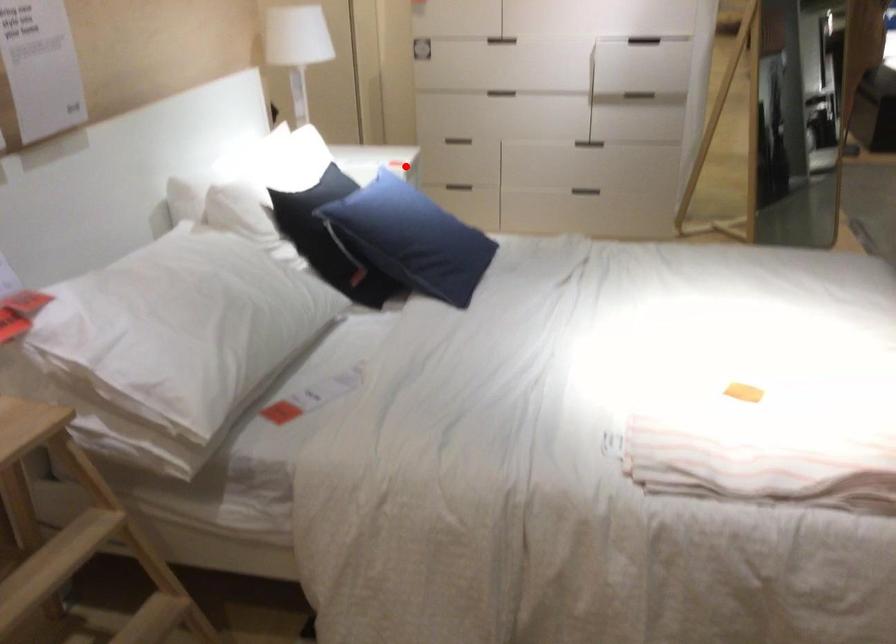
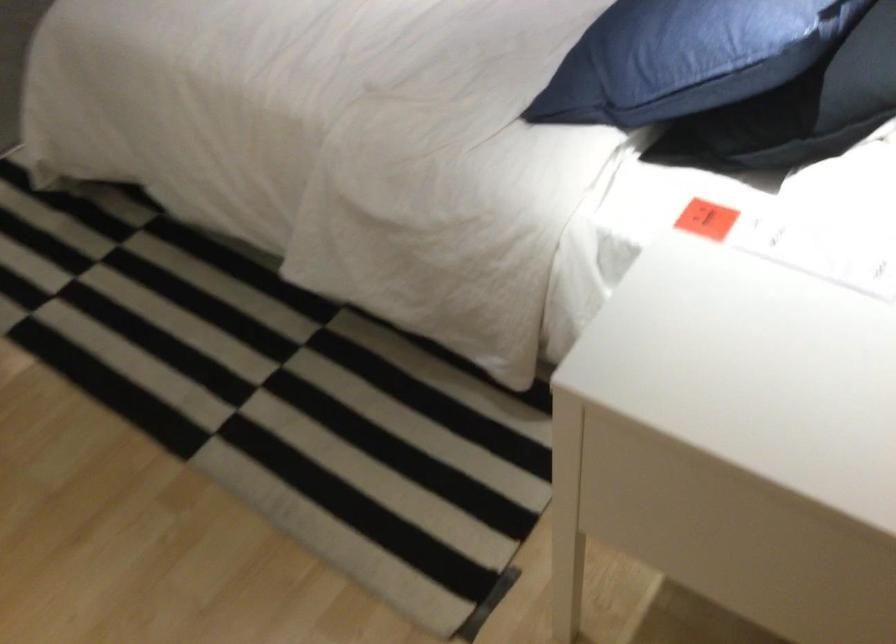
Question: A red point is marked in image1. In image2, is the corresponding 3D point closer to the camera or farther? Reply with the corresponding letter.

Choices:
 (A) The corresponding 3D point is closer.
 (B) The corresponding 3D point is farther.

Answer: (A)